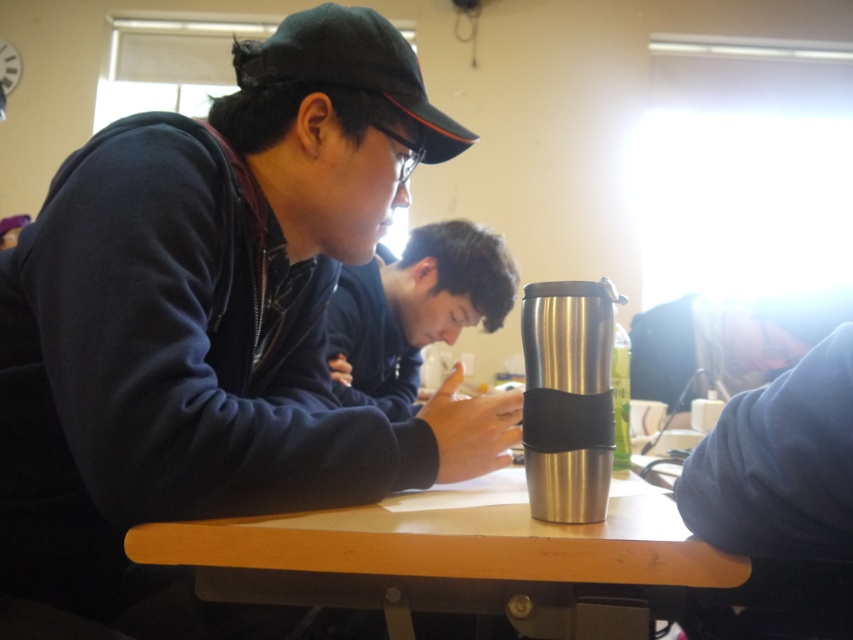
Question: Which object is farther from the camera taking this photo?

Choices:
 (A) black fabric baseball cap at upper left
 (B) silver metallic travel mug at center
 (C) matte black phone at center
 (D) silver metallic cup at center

Answer: (C)

Question: Is matte black phone at center positioned in front of silver metallic travel mug at center?

Choices:
 (A) no
 (B) yes

Answer: (A)

Question: Which point appears farthest from the camera in this image?

Choices:
 (A) (361, 88)
 (B) (351, 387)
 (C) (555, 337)

Answer: (B)

Question: Does matte black cap at upper left come in front of matte black phone at center?

Choices:
 (A) no
 (B) yes

Answer: (B)

Question: Which of the following is the farthest from the observer?

Choices:
 (A) silver metallic cup at center
 (B) matte black cap at upper left

Answer: (B)

Question: Can you confirm if matte black phone at center is positioned to the right of black fabric baseball cap at upper left?

Choices:
 (A) yes
 (B) no

Answer: (A)